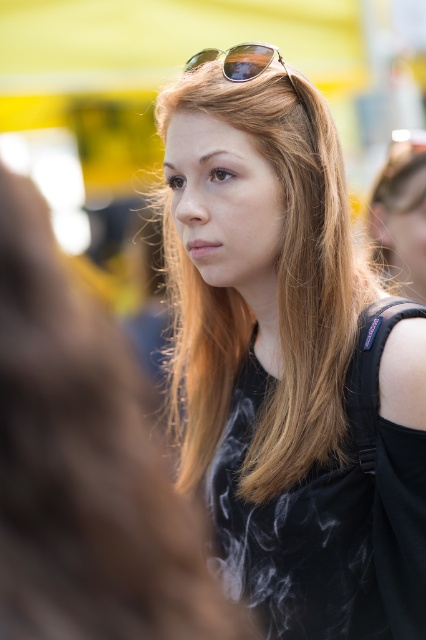
Question: Does matte black shirt at center lie behind gold reflective sunglasses at upper center?

Choices:
 (A) no
 (B) yes

Answer: (A)

Question: Which object is positioned closest to the matte black shirt at center?

Choices:
 (A) gold reflective sunglasses at upper center
 (B) smooth brown hair at center

Answer: (A)

Question: Which object is closer to the camera taking this photo?

Choices:
 (A) smooth brown hair at center
 (B) gold reflective sunglasses at upper center
 (C) matte black shirt at center

Answer: (A)

Question: Is matte black shirt at center to the right of gold reflective sunglasses at upper center from the viewer's perspective?

Choices:
 (A) no
 (B) yes

Answer: (A)

Question: Which of the following is the closest to the observer?

Choices:
 (A) smooth brown hair at center
 (B) matte black shirt at center
 (C) gold reflective sunglasses at upper center

Answer: (A)

Question: Does smooth brown hair at center have a greater width compared to gold reflective sunglasses at upper center?

Choices:
 (A) yes
 (B) no

Answer: (B)